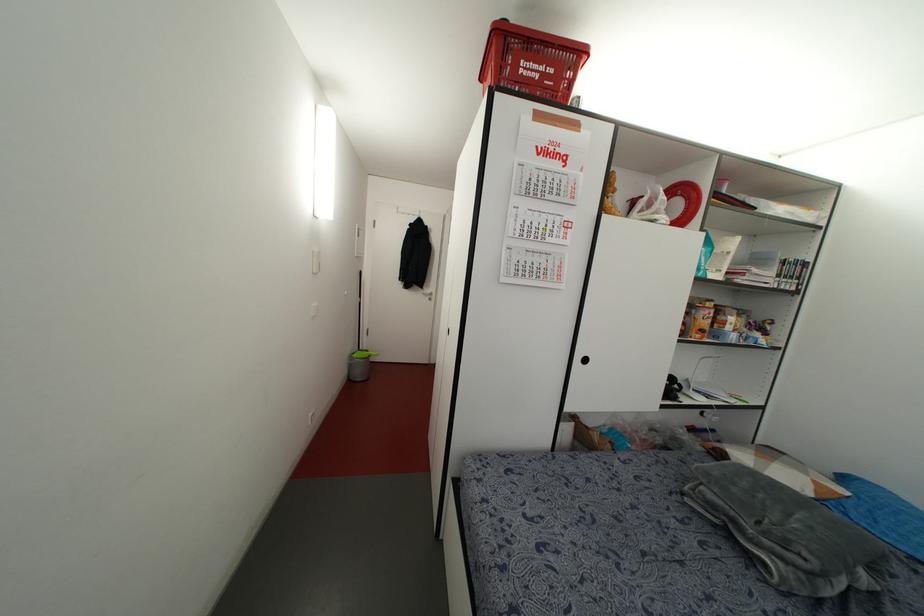
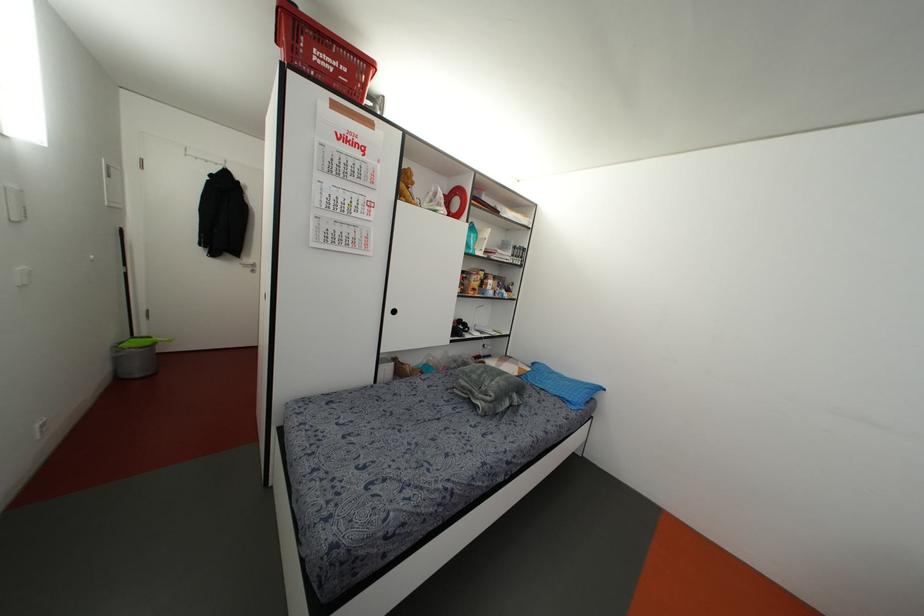
In the second image, find the point that corresponds to point (369, 355) in the first image.

(153, 342)